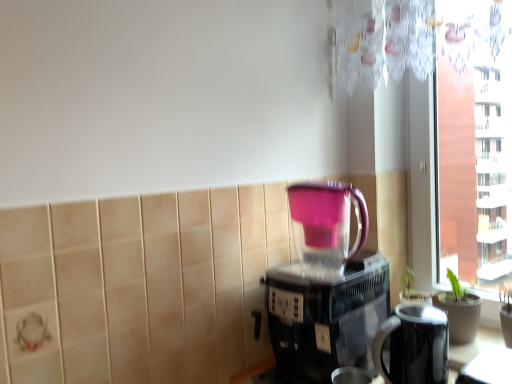
Question: Considering their positions, is transparent glass window at right located in front of or behind black plastic coffee maker at center?

Choices:
 (A) behind
 (B) front

Answer: (A)

Question: Do you think transparent glass window at right is within black plastic coffee maker at center, or outside of it?

Choices:
 (A) inside
 (B) outside

Answer: (B)

Question: Which object is positioned closest to the pink plastic blender at center?

Choices:
 (A) black glossy electric kettle at lower right
 (B) transparent glass window at right
 (C) black plastic coffee maker at center

Answer: (C)

Question: Which object is the farthest from the black plastic coffee maker at center?

Choices:
 (A) transparent glass window at right
 (B) pink plastic blender at center
 (C) black glossy electric kettle at lower right

Answer: (A)